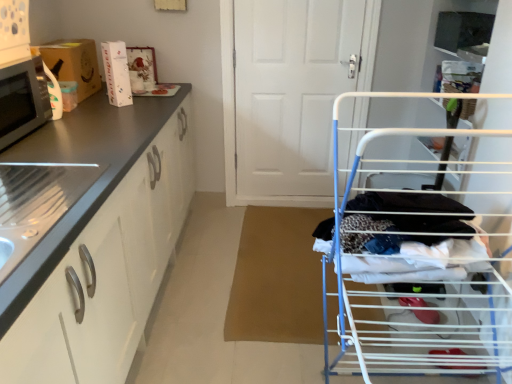
What is the approximate height of white wire drying rack at right?

white wire drying rack at right is 1.23 meters tall.

Describe the element at coordinates (74, 63) in the screenshot. I see `matte cardboard box at left` at that location.

This screenshot has height=384, width=512. I want to click on brushed metal drawer at left, so click(x=77, y=316).

What do you see at coordinates (90, 236) in the screenshot?
I see `white glossy cabinet at left` at bounding box center [90, 236].

What are the coordinates of `white wire drying rack at right` in the screenshot? It's located at (413, 268).

Considering their positions, is brushed metal drawer at left located in front of or behind matte cardboard box at left?

brushed metal drawer at left is in front of matte cardboard box at left.

From the image's perspective, would you say brushed metal drawer at left is shown under matte cardboard box at left?

Indeed, from the image's perspective, brushed metal drawer at left is shown beneath matte cardboard box at left.

Can you confirm if brushed metal drawer at left is smaller than matte cardboard box at left?

No, brushed metal drawer at left is not smaller than matte cardboard box at left.

Could you tell me if brushed metal drawer at left is facing matte cardboard box at left?

No, brushed metal drawer at left is not aimed at matte cardboard box at left.

Does brushed metal drawer at left appear on the left side of white matte door at center?

Correct, you'll find brushed metal drawer at left to the left of white matte door at center.

From a real-world perspective, who is located lower, brushed metal drawer at left or white matte door at center?

white matte door at center.

From the picture: What's the angular difference between brushed metal drawer at left and white matte door at center's facing directions?

There is a 89.4-degree angle between the facing directions of brushed metal drawer at left and white matte door at center.

Does point (73, 273) come in front of point (274, 101)?

That is True.

From a real-world perspective, which is physically below, matte cardboard box at left or white glossy cabinet at left?

white glossy cabinet at left, from a real-world perspective.

Which is more to the left, matte cardboard box at left or white glossy cabinet at left?

Positioned to the left is matte cardboard box at left.

From the image's perspective, which one is positioned higher, matte cardboard box at left or white glossy cabinet at left?

matte cardboard box at left appears higher in the image.

Would you say white wire drying rack at right is part of white matte door at center's contents?

No, white matte door at center does not contain white wire drying rack at right.

Does white matte door at center turn towards white wire drying rack at right?

Yes.

From a real-world perspective, relative to white wire drying rack at right, is white matte door at center vertically above or below?

Clearly, from a real-world perspective, white matte door at center is above white wire drying rack at right.

Locate an element on the screen. door above the white wire drying rack at right (from the image's perspective) is located at coordinates (289, 93).

Would you say brushed metal drawer at left is inside or outside matte black microwave at left?

brushed metal drawer at left cannot be found inside matte black microwave at left.

Is brushed metal drawer at left far from matte black microwave at left?

No, there isn't a large distance between brushed metal drawer at left and matte black microwave at left.

Visually, is brushed metal drawer at left positioned to the left or to the right of matte black microwave at left?

brushed metal drawer at left is positioned on matte black microwave at left's right side.

From a real-world perspective, is brushed metal drawer at left positioned under matte black microwave at left based on gravity?

Correct, in the physical world, brushed metal drawer at left is lower than matte black microwave at left.

From a real-world perspective, is white wire drying rack at right positioned over white matte door at center based on gravity?

No.

Between white wire drying rack at right and white matte door at center, which one has smaller size?

white matte door at center is smaller.

Considering the positions of objects white wire drying rack at right and white matte door at center in the image provided, who is more to the left, white wire drying rack at right or white matte door at center?

From the viewer's perspective, white matte door at center appears more on the left side.

From the image's perspective, does white wire drying rack at right appear higher than white matte door at center?

Incorrect, from the image's perspective, white wire drying rack at right is lower than white matte door at center.

Looking at this image, does white glossy cabinet at left have a smaller size compared to white wire drying rack at right?

Incorrect, white glossy cabinet at left is not smaller in size than white wire drying rack at right.

Is white glossy cabinet at left taller than white wire drying rack at right?

Incorrect, the height of white glossy cabinet at left is not larger of that of white wire drying rack at right.

Considering the points (161, 269) and (432, 355), which point is behind, point (161, 269) or point (432, 355)?

Point (161, 269)

Is white glossy cabinet at left facing away from white wire drying rack at right?

white glossy cabinet at left does not have its back to white wire drying rack at right.

I want to click on drawer located underneath the matte cardboard box at left (from a real-world perspective), so click(77, 316).

In order to click on drawer positioned vertically above the white matte door at center (from a real-world perspective) in this screenshot , I will do `click(77, 316)`.

Consider the image. Estimate the real-world distances between objects in this image. Which object is closer to matte black microwave at left, brushed metal drawer at left or white matte door at center?

brushed metal drawer at left is closer to matte black microwave at left.

Based on their spatial positions, is matte black microwave at left or white wire drying rack at right further from white matte door at center?

Based on the image, matte black microwave at left appears to be further to white matte door at center.

Looking at this image, which object lies nearer to the anchor point brushed metal drawer at left, white wire drying rack at right or white glossy cabinet at left?

white glossy cabinet at left.

Considering their positions, is white glossy cabinet at left positioned closer to white wire drying rack at right than brushed metal drawer at left?

A: The object closer to white wire drying rack at right is brushed metal drawer at left.

Which object lies further to the anchor point white glossy cabinet at left, matte cardboard box at left or brushed metal drawer at left?

Based on the image, matte cardboard box at left appears to be further to white glossy cabinet at left.

From the image, which object appears to be farther from matte cardboard box at left, white matte door at center or white wire drying rack at right?

The object further to matte cardboard box at left is white wire drying rack at right.

Which object lies further to the anchor point matte black microwave at left, brushed metal drawer at left or matte cardboard box at left?

brushed metal drawer at left is positioned further to the anchor matte black microwave at left.

From the image, which object appears to be nearer to white glossy cabinet at left, brushed metal drawer at left or white matte door at center?

brushed metal drawer at left.

This screenshot has height=384, width=512. I want to click on drawer located between white wire drying rack at right and white matte door at center in the depth direction, so click(77, 316).

Where is `cardboard box between white glossy cabinet at left and white matte door at center in the front-back direction`? The height and width of the screenshot is (384, 512). cardboard box between white glossy cabinet at left and white matte door at center in the front-back direction is located at coordinates (74, 63).

Find the location of a particular element. The width and height of the screenshot is (512, 384). drawer situated between matte black microwave at left and white wire drying rack at right from left to right is located at coordinates (77, 316).

Locate an element on the screen. This screenshot has width=512, height=384. microwave oven between matte cardboard box at left and white matte door at center in the horizontal direction is located at coordinates (22, 100).